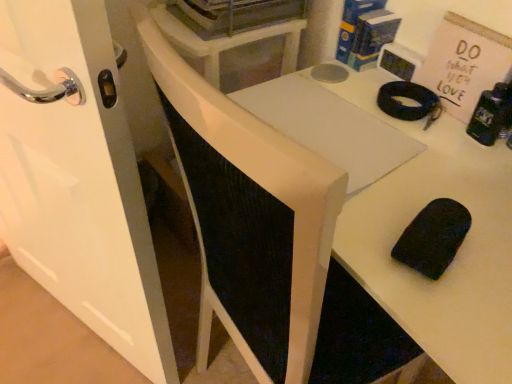
This screenshot has width=512, height=384. Find the location of `free location in front of matte black clock at upper right, which is the 2th appliance from left to right`. free location in front of matte black clock at upper right, which is the 2th appliance from left to right is located at coordinates (396, 121).